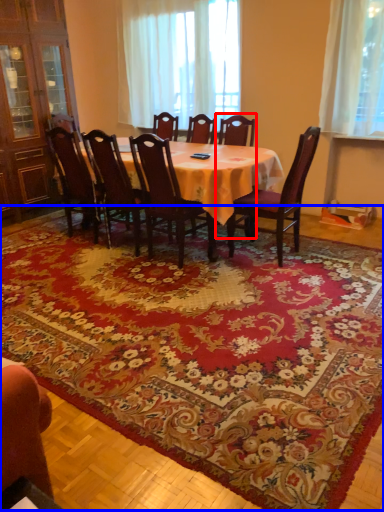
Question: Which object appears closest to the camera in this image, chair (highlighted by a red box) or mat (highlighted by a blue box)?

Choices:
 (A) chair
 (B) mat

Answer: (B)